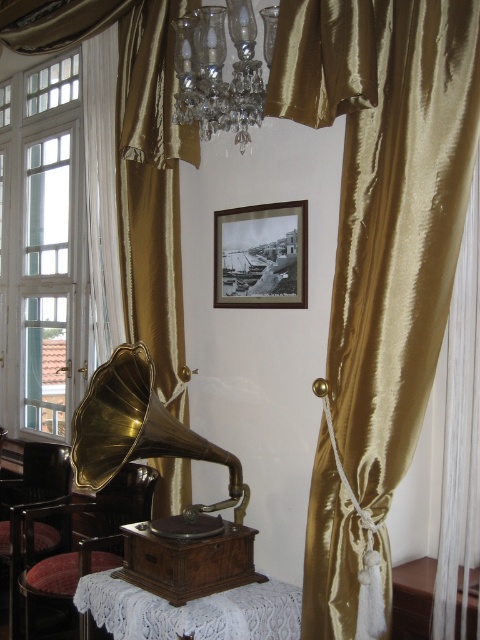
Who is positioned more to the right, gold silk curtain at right or white lace table at center?

gold silk curtain at right is more to the right.

Which is in front, point (396, 456) or point (238, 595)?

Positioned in front is point (396, 456).

In order to click on gold silk curtain at right in this screenshot , I will do `click(385, 204)`.

Between white lace table at center and clear glass window at upper left, which one has less height?

With less height is white lace table at center.

Measure the distance between white lace table at center and camera.

white lace table at center is 6.39 feet from camera.

This screenshot has width=480, height=640. I want to click on white lace table at center, so click(x=192, y=611).

Can you confirm if gold silk curtain at right is positioned above velvet red chair at lower left?

Yes.

Between point (355, 88) and point (133, 499), which one is positioned in front?

Point (355, 88)

The height and width of the screenshot is (640, 480). Describe the element at coordinates (385, 204) in the screenshot. I see `gold silk curtain at right` at that location.

Image resolution: width=480 pixels, height=640 pixels. Find the location of `gold silk curtain at right`. gold silk curtain at right is located at coordinates (385, 204).